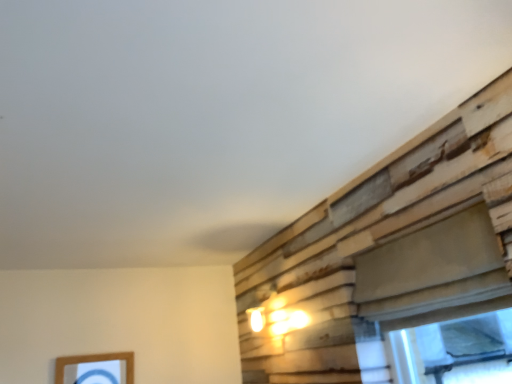
Identify the location of smooth beige window at right. (434, 274).

The image size is (512, 384). Describe the element at coordinates (434, 274) in the screenshot. I see `smooth beige window at right` at that location.

In order to face smooth beige window at right, should I rotate leftwards or rightwards?

Turn right approximately 21.369 degrees to face it.

What is the approximate width of smooth beige window at right?

smooth beige window at right is 15.65 centimeters wide.

The height and width of the screenshot is (384, 512). Describe the element at coordinates (96, 368) in the screenshot. I see `wooden picture frame at lower left` at that location.

Measure the distance between point (x=103, y=369) and camera.

The distance of point (x=103, y=369) from camera is 2.99 meters.

The width and height of the screenshot is (512, 384). In order to click on wooden picture frame at lower left in this screenshot , I will do `click(96, 368)`.

Where is `smooth beige window at right`? This screenshot has height=384, width=512. smooth beige window at right is located at coordinates (434, 274).

Which is more to the right, wooden picture frame at lower left or smooth beige window at right?

Positioned to the right is smooth beige window at right.

Based on the photo, in the image, is wooden picture frame at lower left positioned in front of or behind smooth beige window at right?

wooden picture frame at lower left is behind smooth beige window at right.

Is point (118, 374) closer or farther from the camera than point (428, 236)?

Point (118, 374).

Consider the image. From the image's perspective, between wooden picture frame at lower left and smooth beige window at right, who is located below?

wooden picture frame at lower left appears lower in the image.

From the picture: From a real-world perspective, which object stands above the other?

smooth beige window at right.

In terms of width, does wooden picture frame at lower left look wider or thinner when compared to smooth beige window at right?

Clearly, wooden picture frame at lower left has less width compared to smooth beige window at right.

Does wooden picture frame at lower left have a lesser height compared to smooth beige window at right?

Indeed, wooden picture frame at lower left has a lesser height compared to smooth beige window at right.

Between wooden picture frame at lower left and smooth beige window at right, which one has smaller size?

wooden picture frame at lower left.

Would you say wooden picture frame at lower left is outside smooth beige window at right?

That's correct, wooden picture frame at lower left is outside of smooth beige window at right.

Are wooden picture frame at lower left and smooth beige window at right making contact?

wooden picture frame at lower left is not next to smooth beige window at right, and they're not touching.

Could you tell me if wooden picture frame at lower left is facing smooth beige window at right?

Yes, wooden picture frame at lower left is turned towards smooth beige window at right.

Where is `picture frame located underneath the smooth beige window at right (from a real-world perspective)`? picture frame located underneath the smooth beige window at right (from a real-world perspective) is located at coordinates (96, 368).

Is smooth beige window at right at the right side of wooden picture frame at lower left?

Correct, you'll find smooth beige window at right to the right of wooden picture frame at lower left.

Consider the image. Which is behind, smooth beige window at right or wooden picture frame at lower left?

wooden picture frame at lower left is further away from the camera.

Which is further, (431, 235) or (122, 364)?

The point (122, 364) is more distant.

From the image's perspective, is smooth beige window at right positioned above or below wooden picture frame at lower left?

From the image's perspective, smooth beige window at right appears above wooden picture frame at lower left.

From a real-world perspective, which is physically above, smooth beige window at right or wooden picture frame at lower left?

smooth beige window at right.

Is smooth beige window at right wider or thinner than wooden picture frame at lower left?

Clearly, smooth beige window at right has more width compared to wooden picture frame at lower left.

In terms of height, does smooth beige window at right look taller or shorter compared to wooden picture frame at lower left?

Clearly, smooth beige window at right is taller compared to wooden picture frame at lower left.

Considering the relative sizes of smooth beige window at right and wooden picture frame at lower left in the image provided, is smooth beige window at right bigger than wooden picture frame at lower left?

Yes, smooth beige window at right is bigger than wooden picture frame at lower left.

Is smooth beige window at right spatially inside wooden picture frame at lower left, or outside of it?

smooth beige window at right is not inside wooden picture frame at lower left, it's outside.

Is smooth beige window at right next to wooden picture frame at lower left?

smooth beige window at right and wooden picture frame at lower left are clearly separated.

Is smooth beige window at right facing away from wooden picture frame at lower left?

No, wooden picture frame at lower left is not at the back of smooth beige window at right.

How many degrees apart are the facing directions of smooth beige window at right and wooden picture frame at lower left?

90.4 degrees separate the facing orientations of smooth beige window at right and wooden picture frame at lower left.

Locate an element on the screen. window in front of the wooden picture frame at lower left is located at coordinates (434, 274).

You are a GUI agent. You are given a task and a screenshot of the screen. Output one action in this format:
    pyautogui.click(x=<x>, y=<y>)
    Task: Click on the picture frame that is behind the smooth beige window at right
    This screenshot has width=512, height=384.
    Given the screenshot: What is the action you would take?
    pyautogui.click(x=96, y=368)

Locate an element on the screen. This screenshot has width=512, height=384. window in front of the wooden picture frame at lower left is located at coordinates (434, 274).